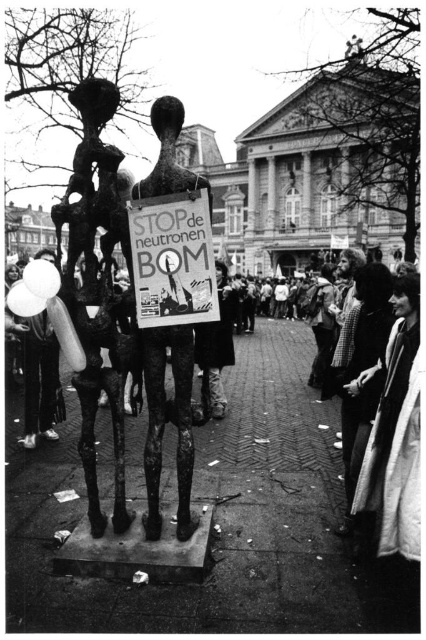
Based on the scene description, which object at the center of the image is bigger between the bronze sculpture at center and the metallic poster at center?

The bronze sculpture at center is larger than the metallic poster at center according to the description.

Where is the bronze sculpture at center located in the image?

The bronze sculpture at center is located at point [97,289].

You are an art student analyzing the composition of the photograph. You notice the bronze sculpture at center and the metallic poster at center. Which object occupies more horizontal space in the image?

The metallic poster at center occupies more horizontal space because it has a greater width than the bronze sculpture at center.